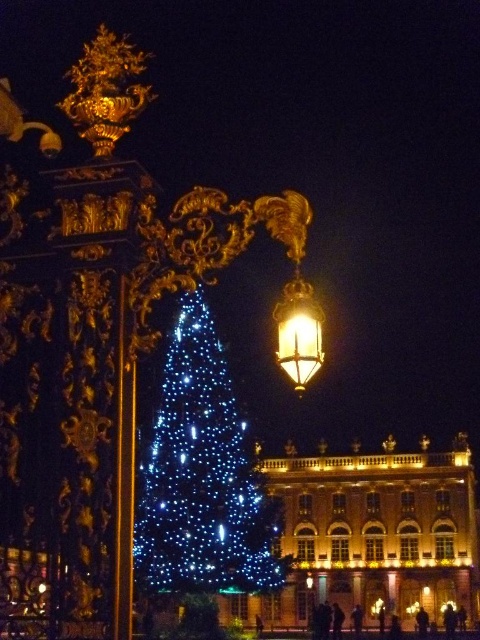
Question: Can you confirm if illuminated plastic christmas tree at center is positioned above gold polished metal street light at center?

Choices:
 (A) no
 (B) yes

Answer: (B)

Question: Is illuminated plastic christmas tree at center positioned behind gold polished metal street light at center?

Choices:
 (A) no
 (B) yes

Answer: (A)

Question: Which object is the closest to the gold metallic lantern at upper center?

Choices:
 (A) illuminated plastic christmas tree at center
 (B) gold polished metal street light at center

Answer: (A)

Question: Is illuminated plastic christmas tree at center below gold polished metal street light at center?

Choices:
 (A) no
 (B) yes

Answer: (A)

Question: Among these points, which one is nearest to the camera?

Choices:
 (A) (310, 365)
 (B) (146, 497)

Answer: (A)

Question: Which point appears farthest from the camera in this image?

Choices:
 (A) (312, 586)
 (B) (184, 564)

Answer: (A)